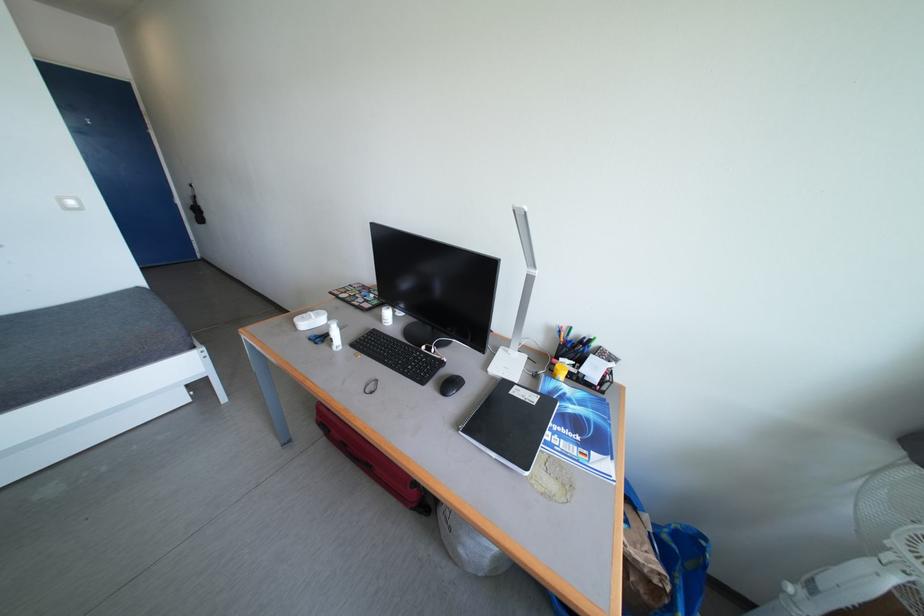
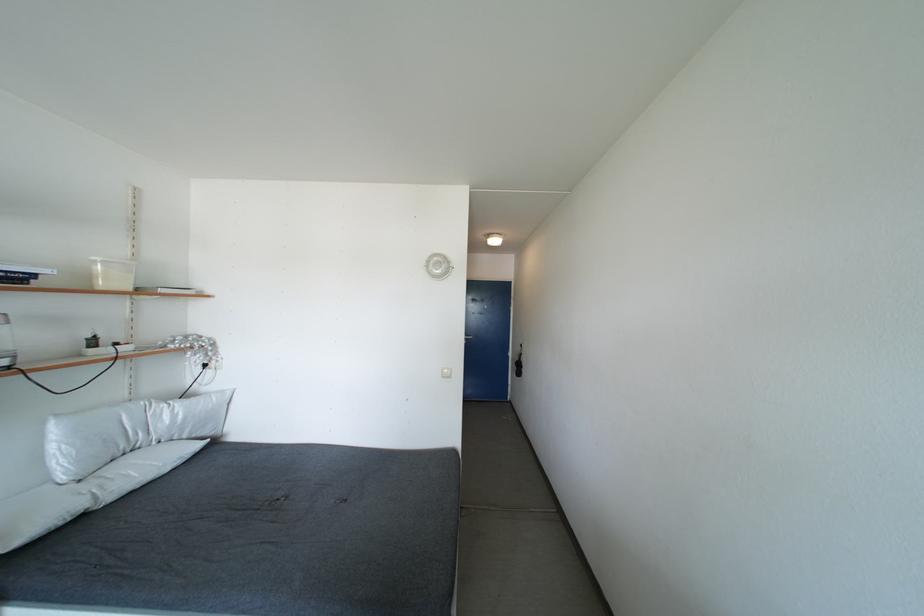
First-person continuous shooting, in which direction is the camera rotating?

The camera's rotation is toward left-up.